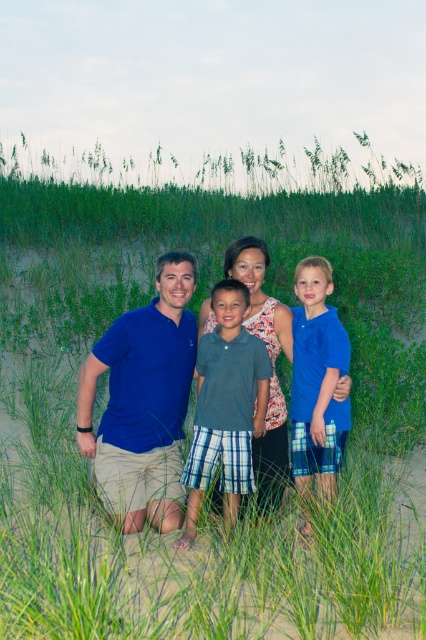
Looking at this image, you are a photographer trying to capture a clear shot of the blue cotton shirt at center and the gray plaid shorts at center. Since both are at the center, which one is closer to the camera?

The gray plaid shorts at center is in front of the blue cotton shirt at center, so it is closer to the camera.